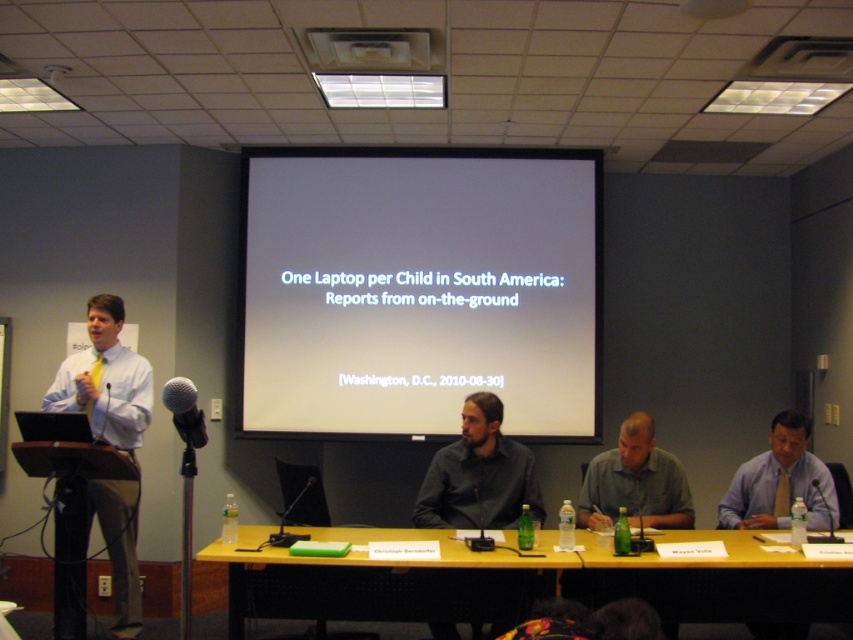
Question: Is gray shirt at center bigger than black metallic microphone at center?

Choices:
 (A) yes
 (B) no

Answer: (A)

Question: Which point is farther from the camera taking this photo?

Choices:
 (A) (120, 417)
 (B) (819, 516)

Answer: (A)

Question: Can you confirm if gray shirt at center is thinner than light blue shirt at center?

Choices:
 (A) no
 (B) yes

Answer: (A)

Question: Which of the following is the closest to the observer?

Choices:
 (A) black metallic microphone at center
 (B) gray shirt at center
 (C) white shirt at left
 (D) white matte projection screen at center

Answer: (A)

Question: Is light blue shirt at center behind black metallic microphone at center?

Choices:
 (A) yes
 (B) no

Answer: (A)

Question: Which point appears closest to the camera in this image?

Choices:
 (A) (816, 456)
 (B) (99, 520)

Answer: (B)